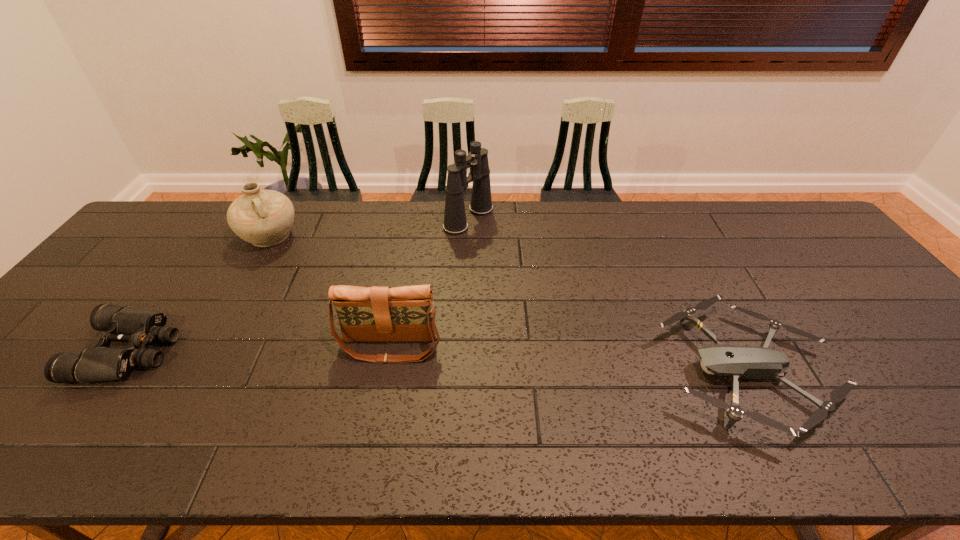
The height and width of the screenshot is (540, 960). What are the coordinates of `vacant region at the near edge of the desktop` in the screenshot? It's located at (907, 454).

Image resolution: width=960 pixels, height=540 pixels. In the image, there is a desktop. Identify the location of free space at the left edge. (153, 268).

Find the location of a particular element. The height and width of the screenshot is (540, 960). free space at the right edge of the desktop is located at coordinates (906, 329).

The image size is (960, 540). What are the coordinates of `free space at the far right corner of the desktop` in the screenshot? It's located at (801, 212).

At what (x,y) coordinates should I click in order to perform the action: click on free point between the pottery and the rightmost object. Please return your answer as a coordinate pair (x, y). The width and height of the screenshot is (960, 540). Looking at the image, I should click on (509, 303).

Locate an element on the screen. This screenshot has width=960, height=540. free space between the drone and the tallest object is located at coordinates (608, 294).

What are the coordinates of `empty location between the taller binoculars and the pottery` in the screenshot? It's located at (370, 227).

Find the location of `vacant area between the pottery and the left binoculars`. vacant area between the pottery and the left binoculars is located at coordinates (200, 294).

What are the coordinates of `free spot between the shoulder bag and the left binoculars` in the screenshot? It's located at (260, 348).

This screenshot has width=960, height=540. I want to click on free point between the left binoculars and the drone, so click(x=439, y=361).